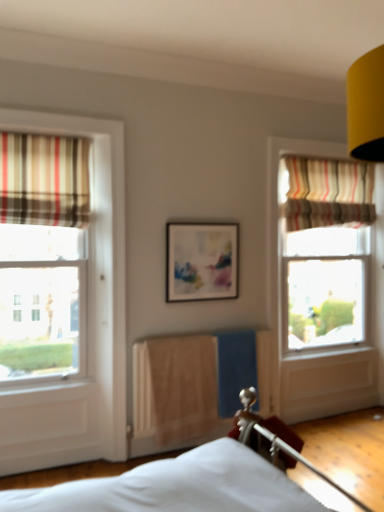
This screenshot has width=384, height=512. What are the coordinates of `free point above striped fabric curtain at upper right, which ranks as the 2th curtain in front-to-back order (from a real-world perspective)` in the screenshot? It's located at (332, 160).